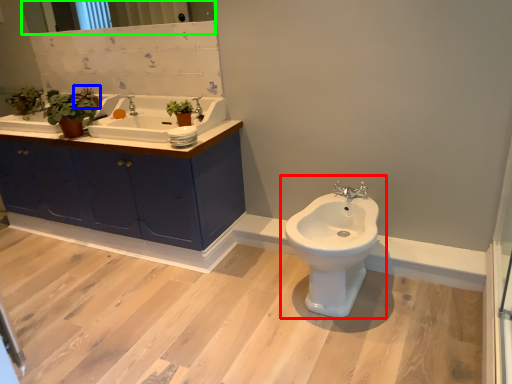
Question: Considering the real-world distances, which object is farthest from toilet (highlighted by a red box)? plant (highlighted by a blue box) or mirror (highlighted by a green box)?

Choices:
 (A) plant
 (B) mirror

Answer: (B)